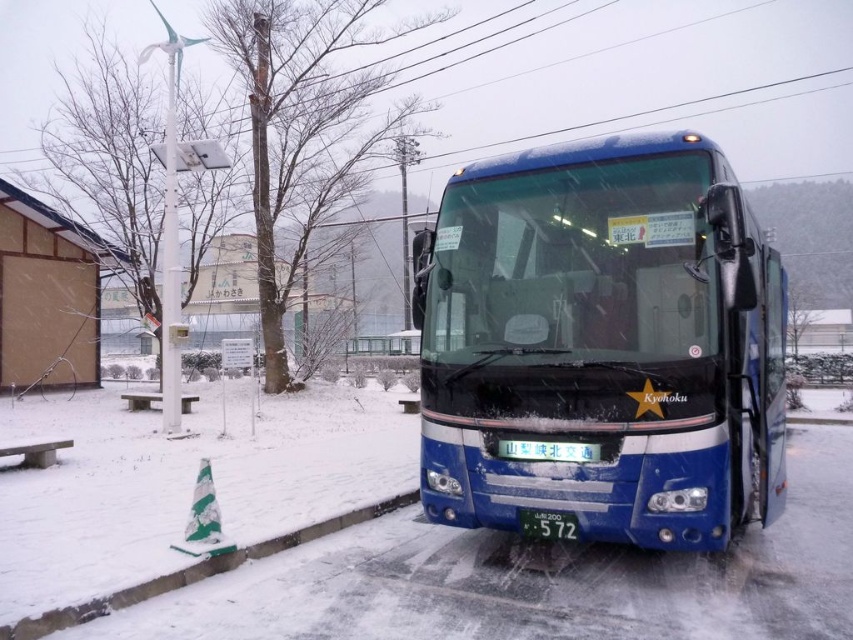
Question: Based on their relative distances, which object is nearer to the green plastic license plate at center?

Choices:
 (A) green striped cone at lower left
 (B) blue metallic bus at center
 (C) green concrete curb at lower left

Answer: (B)

Question: Which point is farther to the camera?

Choices:
 (A) green plastic license plate at center
 (B) blue metallic bus at center
 (C) green matte license plate at center

Answer: (A)

Question: In this image, where is green striped cone at lower left located relative to green matte license plate at center?

Choices:
 (A) above
 (B) below

Answer: (B)

Question: Estimate the real-world distances between objects in this image. Which object is closer to the blue metallic bus at center?

Choices:
 (A) green concrete curb at lower left
 (B) green plastic license plate at center
 (C) green striped cone at lower left

Answer: (B)

Question: Can you confirm if green striped cone at lower left is bigger than green matte license plate at center?

Choices:
 (A) yes
 (B) no

Answer: (A)

Question: Can you confirm if green concrete curb at lower left is positioned below green matte license plate at center?

Choices:
 (A) yes
 (B) no

Answer: (A)